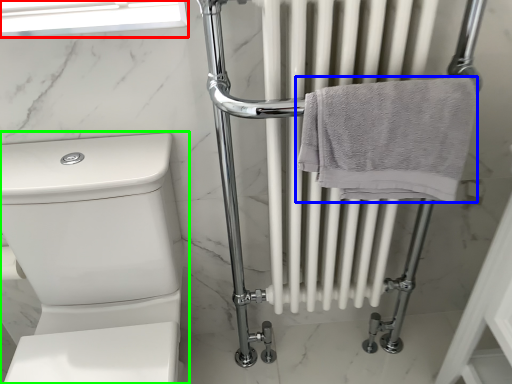
Question: Which object is positioned farthest from window screen (highlighted by a red box)? Select from towel (highlighted by a blue box) and toilet (highlighted by a green box).

Choices:
 (A) towel
 (B) toilet

Answer: (A)